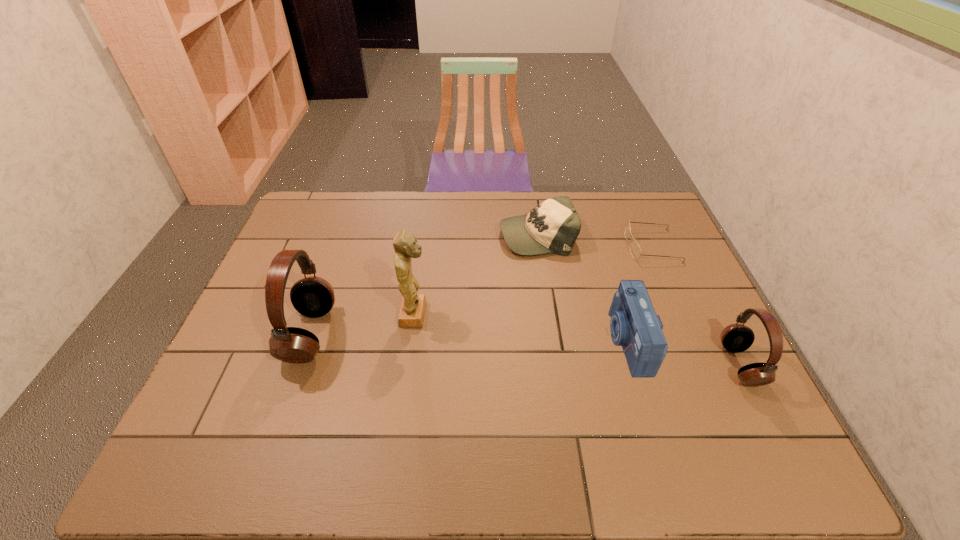
Where is `blank region between the shorter headset and the taller headset`? The image size is (960, 540). blank region between the shorter headset and the taller headset is located at coordinates (525, 349).

In order to click on vacant space that is in between the shorter headset and the third object from right to left in this screenshot , I will do `click(684, 353)`.

I want to click on vacant area that lies between the baseball cap and the spectacles, so click(594, 240).

Identify the location of vacant area between the third shortest object and the second shortest object. (583, 288).

Image resolution: width=960 pixels, height=540 pixels. Find the location of `blank region between the camera and the fifth object from right to left`. blank region between the camera and the fifth object from right to left is located at coordinates (521, 328).

Where is `vacant space in between the fourth tallest object and the fifth tallest object`? vacant space in between the fourth tallest object and the fifth tallest object is located at coordinates (583, 288).

The image size is (960, 540). I want to click on vacant space that's between the fifth tallest object and the leftmost object, so click(423, 285).

The image size is (960, 540). Find the location of `free space between the spectacles and the left headset`. free space between the spectacles and the left headset is located at coordinates (481, 290).

Choose which object is the second nearest neighbor to the shortest object. Please provide its 2D coordinates. Your answer should be formatted as a tuple, i.e. [(x, y)], where the tuple contains the x and y coordinates of a point satisfying the conditions above.

[(634, 325)]

You are a GUI agent. You are given a task and a screenshot of the screen. Output one action in this format:
    pyautogui.click(x=<x>, y=<y>)
    Task: Click on the fifth closest object to the leftmost object
    
    Given the screenshot: What is the action you would take?
    pyautogui.click(x=736, y=337)